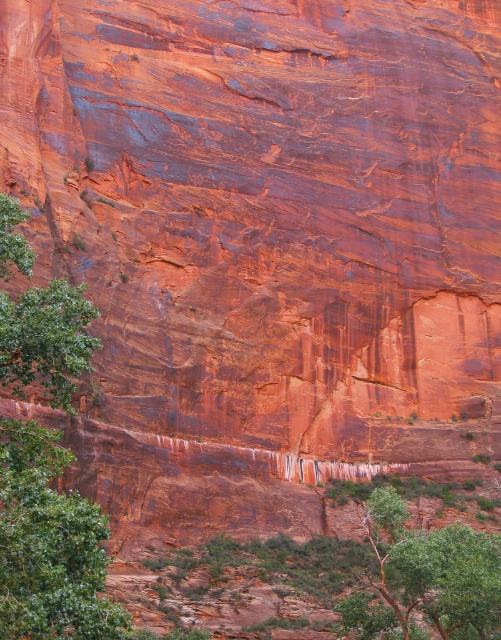
Question: From the image, what is the correct spatial relationship of green leafy tree at left in relation to green leafy tree at lower center?

Choices:
 (A) above
 (B) below

Answer: (A)

Question: Which of the following is the farthest from the observer?

Choices:
 (A) (33, 536)
 (B) (466, 609)

Answer: (B)

Question: Which point is farther to the camera?

Choices:
 (A) (42, 323)
 (B) (390, 552)

Answer: (B)

Question: Can you confirm if green leafy tree at left is positioned to the left of green leafy tree at lower center?

Choices:
 (A) no
 (B) yes

Answer: (B)

Question: From the image, what is the correct spatial relationship of green leafy tree at left in relation to green leafy tree at lower center?

Choices:
 (A) right
 (B) left

Answer: (B)